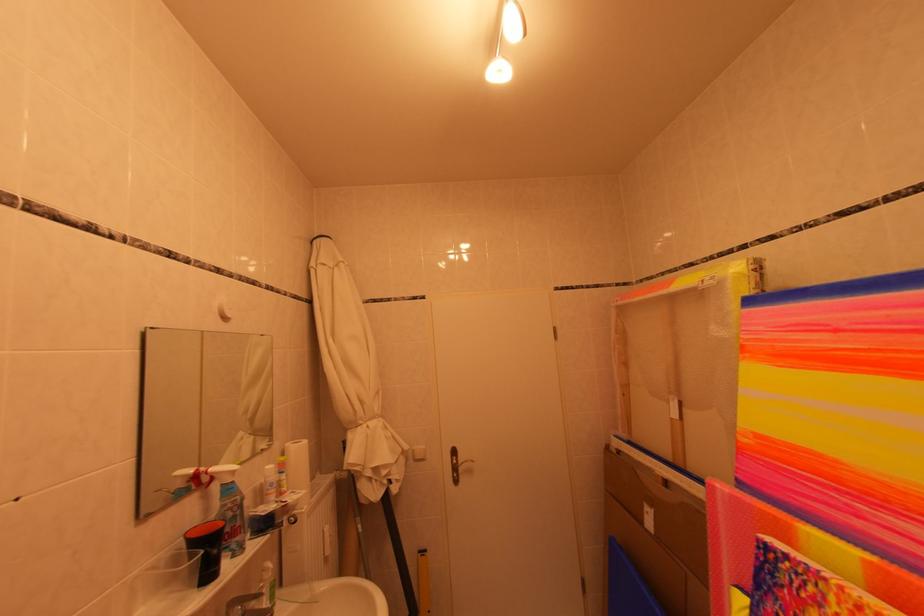
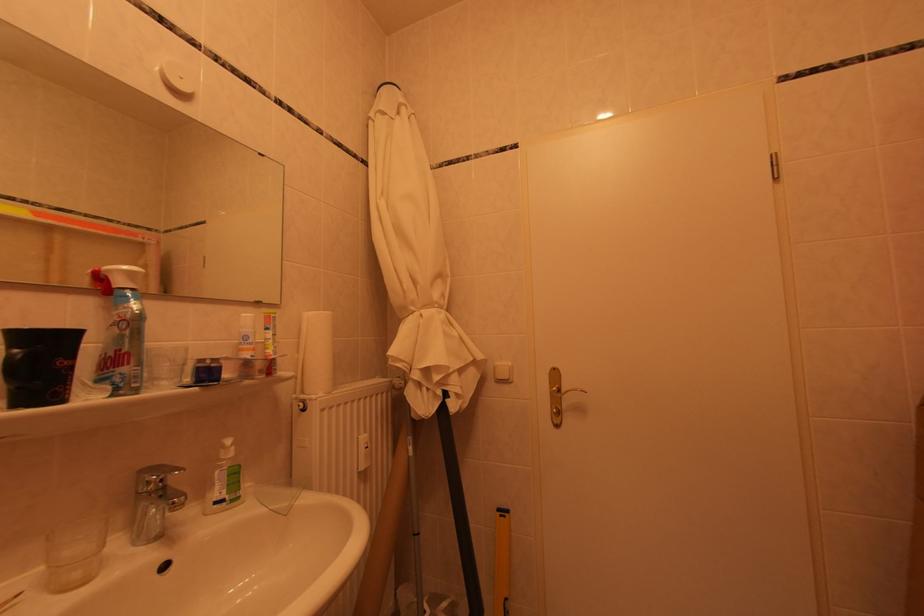
Question: Which direction would the cameraman need to move to produce the second image? Reply with the corresponding letter.

Choices:
 (A) Left
 (B) Right
 (C) Forward
 (D) Backward

Answer: (C)